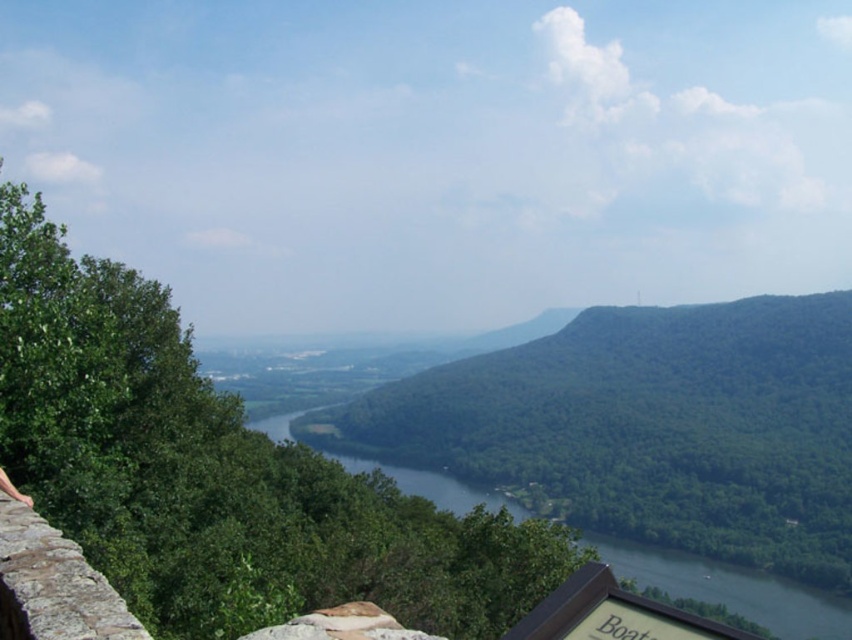
Does green glossy water at center have a lesser height compared to wooden signboard at lower right?

No, green glossy water at center is not shorter than wooden signboard at lower right.

Who is positioned more to the right, green glossy water at center or wooden signboard at lower right?

wooden signboard at lower right is more to the right.

Locate an element on the screen. green glossy water at center is located at coordinates (730, 588).